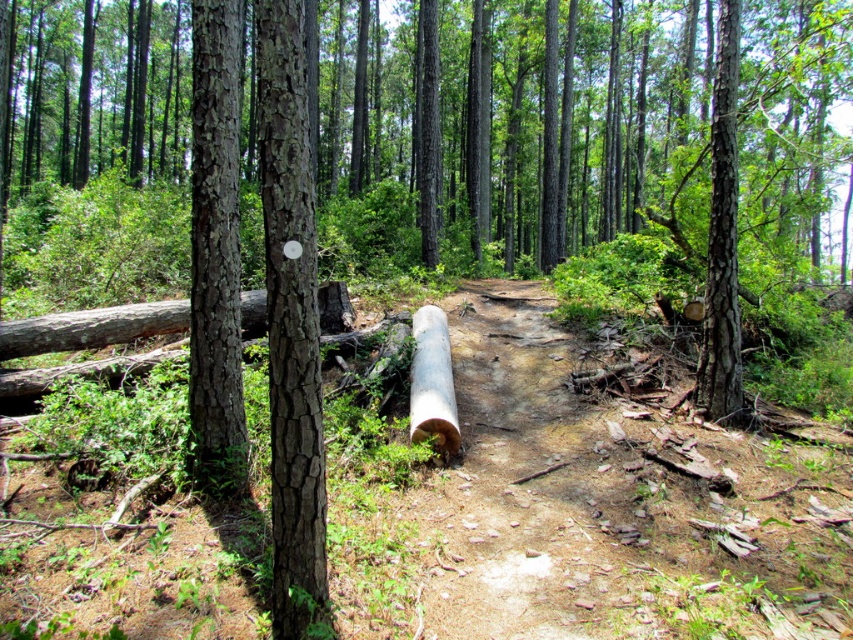
Which is behind, point (277, 490) or point (209, 42)?

The point (209, 42) is behind.

Is brown rough bark tree trunk at center bigger than smooth brown bark at center?

Actually, brown rough bark tree trunk at center might be smaller than smooth brown bark at center.

Does point (280, 611) come closer to viewer compared to point (236, 189)?

Yes, it is.

Image resolution: width=853 pixels, height=640 pixels. I want to click on brown rough bark tree trunk at center, so click(x=291, y=326).

Consider the image. How distant is smooth wood log at center from smooth brown bark at center?

smooth wood log at center and smooth brown bark at center are 1.89 meters apart.

Does smooth wood log at center appear on the right side of smooth brown bark at center?

Correct, you'll find smooth wood log at center to the right of smooth brown bark at center.

Which is in front, point (451, 371) or point (223, 372)?

Point (223, 372) is more forward.

This screenshot has height=640, width=853. I want to click on smooth wood log at center, so click(532, 486).

Who is positioned more to the right, brown rough bark tree trunk at center or brown rough bark tree trunk at right?

brown rough bark tree trunk at right is more to the right.

Is point (280, 541) behind point (738, 403)?

That is False.

Is point (292, 83) in front of point (728, 337)?

That is True.

This screenshot has width=853, height=640. I want to click on brown rough bark tree trunk at center, so [291, 326].